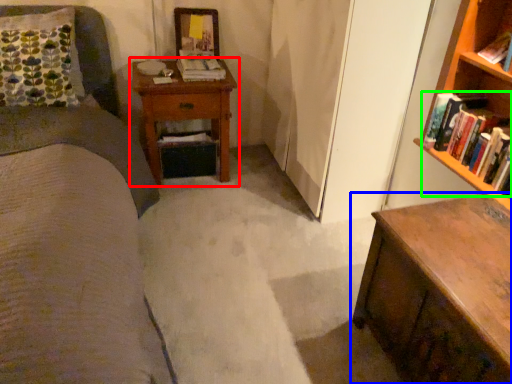
Question: Which object is the farthest from nightstand (highlighted by a red box)? Choose among these: chest of drawers (highlighted by a blue box) or book (highlighted by a green box).

Choices:
 (A) chest of drawers
 (B) book

Answer: (A)